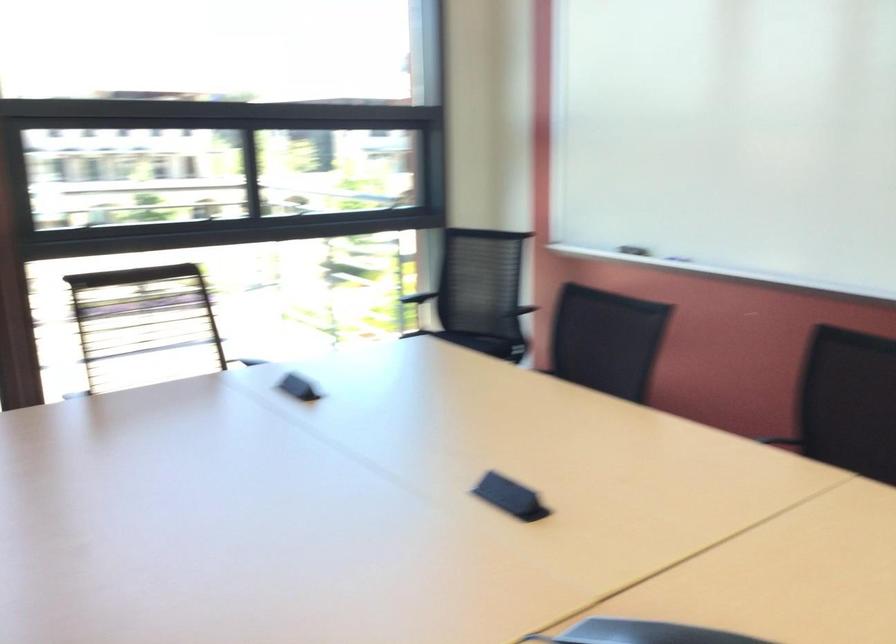
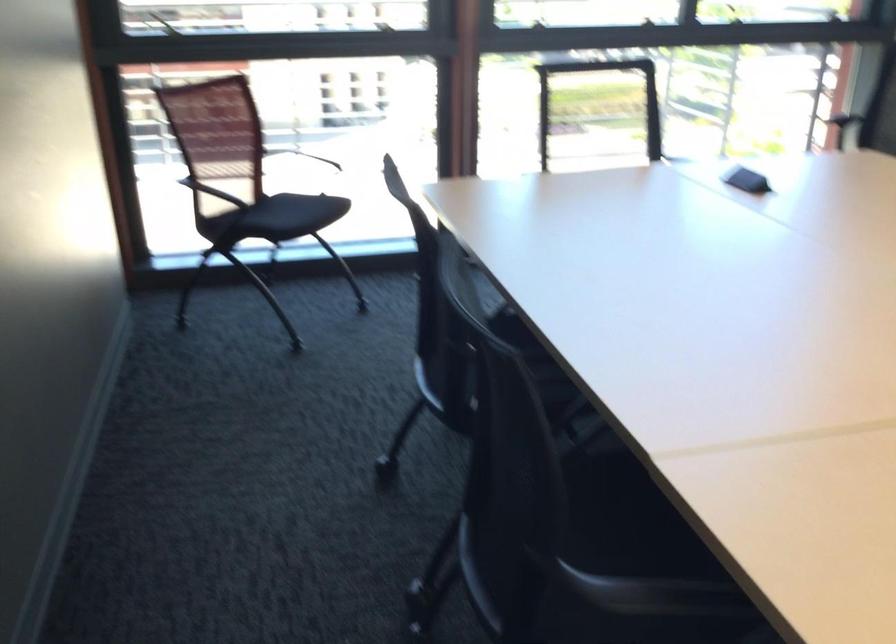
Question: The images are taken continuously from a first-person perspective. In which direction is your viewpoint rotating?

Choices:
 (A) Left
 (B) Right
 (C) Up
 (D) Down

Answer: (A)